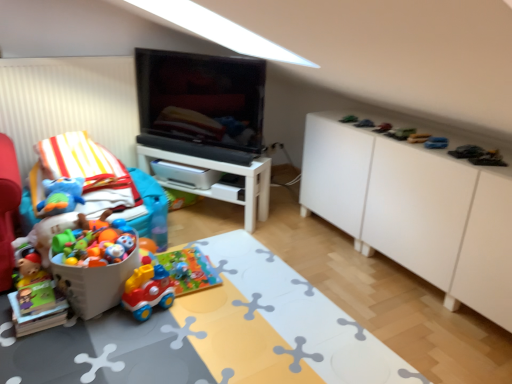
The image size is (512, 384). I want to click on free space to the left of dark green fabric toy at upper right, arranged as the 2th toy when viewed from the right, so click(434, 148).